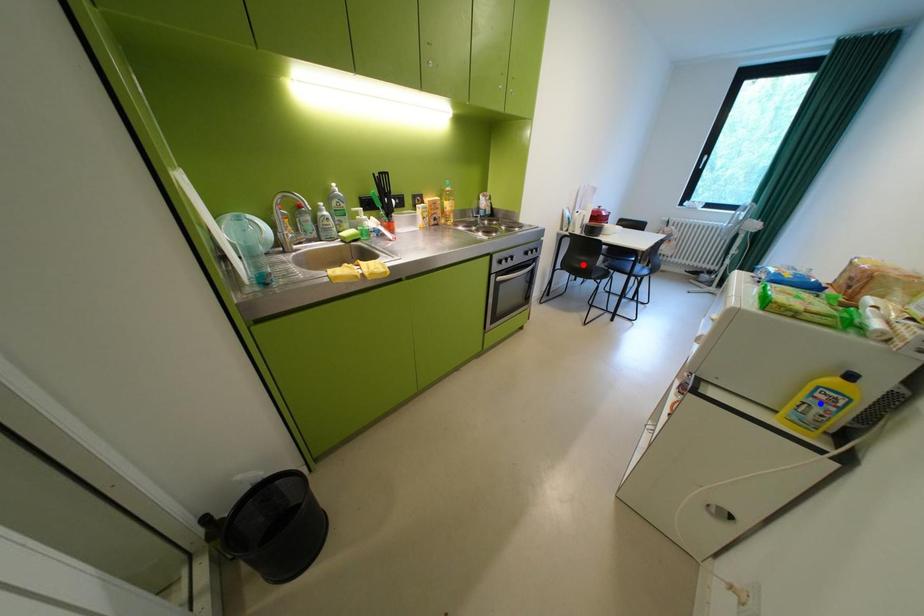
Question: Which of the two points in the image is closer to the camera?

Choices:
 (A) Blue point is closer.
 (B) Red point is closer.

Answer: (A)